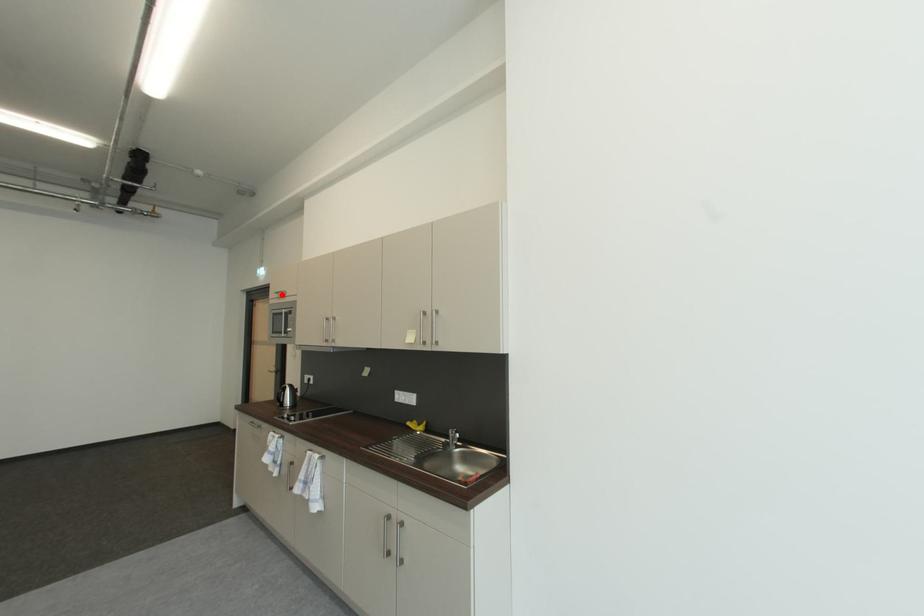
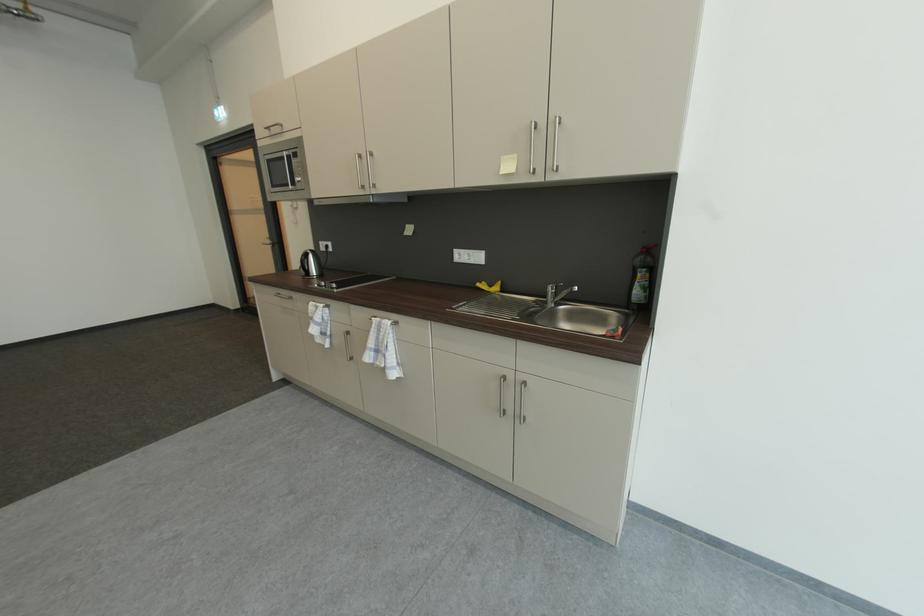
In the second image, find the point that corresponds to the highlighted location in the first image.

(273, 130)